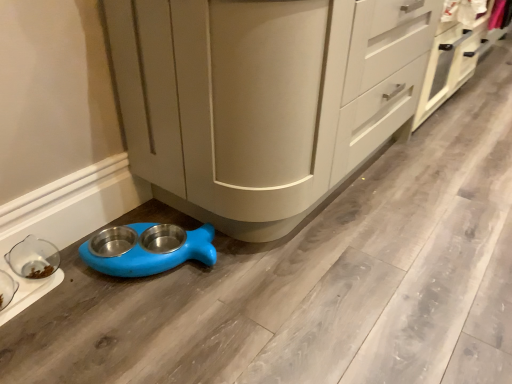
Find the location of a particular element. The image size is (512, 384). free space to the right of transparent glass bowl at lower left, placed as the second appliance when sorted from right to left is located at coordinates (76, 305).